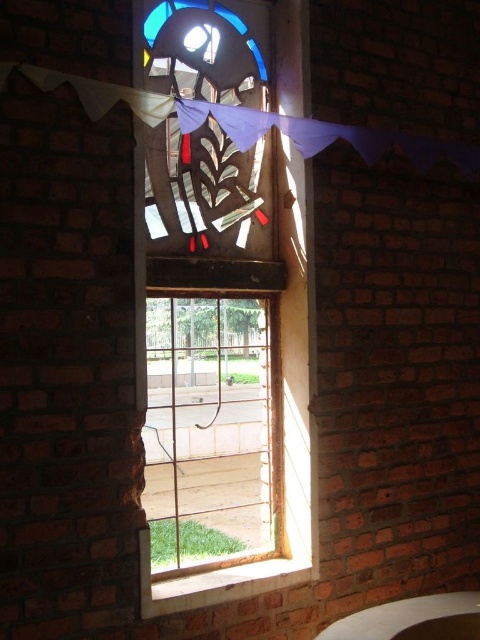
Based on the photo, you are an interior designer planning to install a new window in a room with a wall that has limited space. You have two options from the image provided. Which window, the stained glass window at center or the clear glass window at center, would you choose if you want the window to occupy more width without exceeding the wall space?

The stained glass window at center has a larger width than the clear glass window at center, so it would be the better choice if you want the window to occupy more width without exceeding the wall space.

In the scene shown: You are an interior designer planning to install a new decorative window. You have two options in the scene, the stained glass window at center and the clear glass window at center. The new window must be placed exactly 4 inches away from the existing window. Can you determine which existing window you can place the new window next to without overlapping?

The stained glass window at center is 3.80 inches from clear glass window at center, so placing a new window 4 inches away from either existing window would not overlap since 4 inches is slightly larger than the 3.80 inches distance between them. Therefore, the new window can be placed next to either the stained glass window at center or the clear glass window at center.

Based on the photo, you are an architect designing a new building and want to replicate the stained glass window at center from the image. To ensure accuracy, what are the coordinates of its position?

The stained glass window at center is positioned at coordinates point (228, 394).